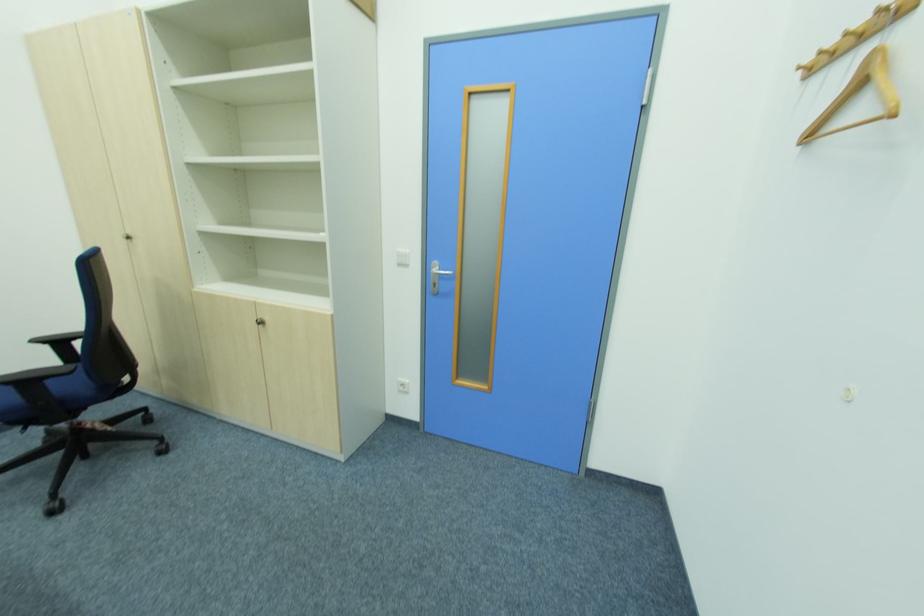
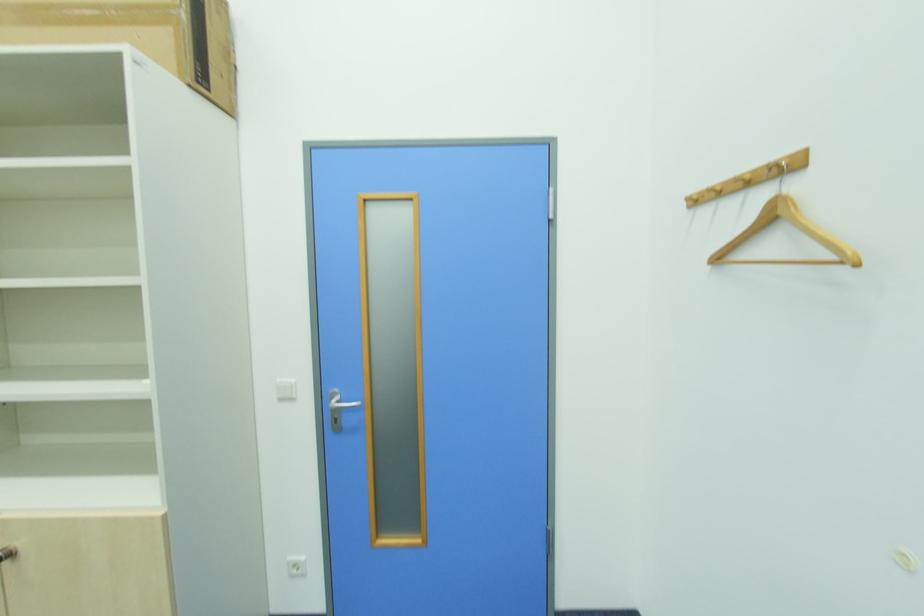
Question: The camera is either moving clockwise (left) or counter-clockwise (right) around the object. The first image is from the beginning of the video and the second image is from the end. Is the camera moving left or right when shooting the video?

Choices:
 (A) Left
 (B) Right

Answer: (A)